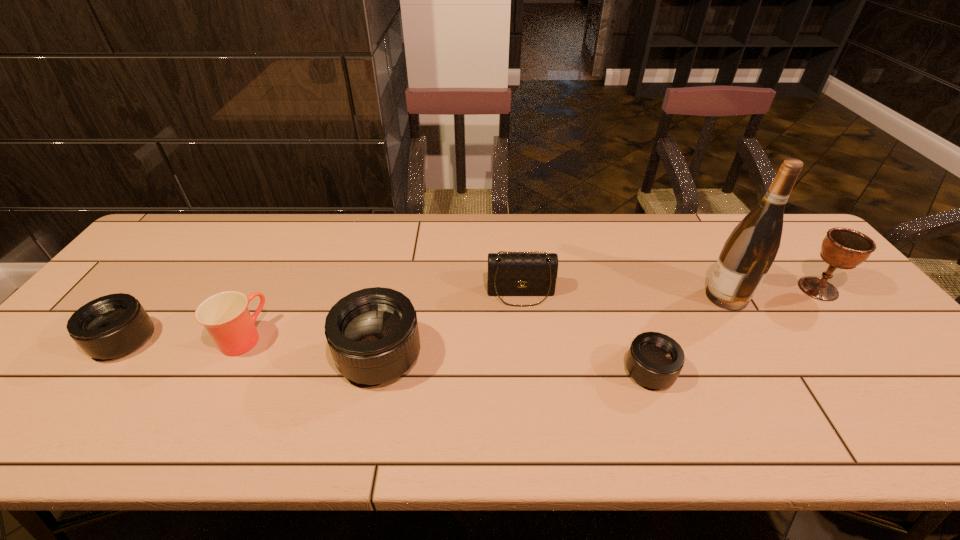
This screenshot has width=960, height=540. Identify the location of blank region between the second tallest object and the fourth object from right to left. (669, 291).

Find the location of a particular element. Image resolution: width=960 pixels, height=540 pixels. unoccupied area between the fifth object from right to left and the clutch bag is located at coordinates (449, 324).

At what (x,y) coordinates should I click in order to perform the action: click on unoccupied position between the shortest telephoto lens and the chalice. Please return your answer as a coordinate pair (x, y). Looking at the image, I should click on (734, 330).

In order to click on empty space between the cup and the rightmost telephoto lens in this screenshot , I will do `click(446, 355)`.

Locate an element on the screen. Image resolution: width=960 pixels, height=540 pixels. empty location between the tallest telephoto lens and the second object from right to left is located at coordinates (552, 326).

You are a GUI agent. You are given a task and a screenshot of the screen. Output one action in this format:
    pyautogui.click(x=<x>, y=<y>)
    Task: Click on the object that stands as the sixth closest to the chalice
    
    Given the screenshot: What is the action you would take?
    pyautogui.click(x=111, y=326)

In order to click on object that stands as the closest to the second object from right to left in this screenshot , I will do `click(843, 248)`.

The height and width of the screenshot is (540, 960). I want to click on the second closest telephoto lens relative to the third object from left to right, so click(655, 360).

Identify which telephoto lens is located as the second nearest to the second object from right to left. Please provide its 2D coordinates. Your answer should be formatted as a tuple, i.e. [(x, y)], where the tuple contains the x and y coordinates of a point satisfying the conditions above.

[(372, 333)]

The height and width of the screenshot is (540, 960). Identify the location of free space that satisfies the following two spatial constraints: 1. on the front flap of the fourth object from right to left; 2. on the side of the tallest telephoto lens with brand markings and control switches. (527, 355).